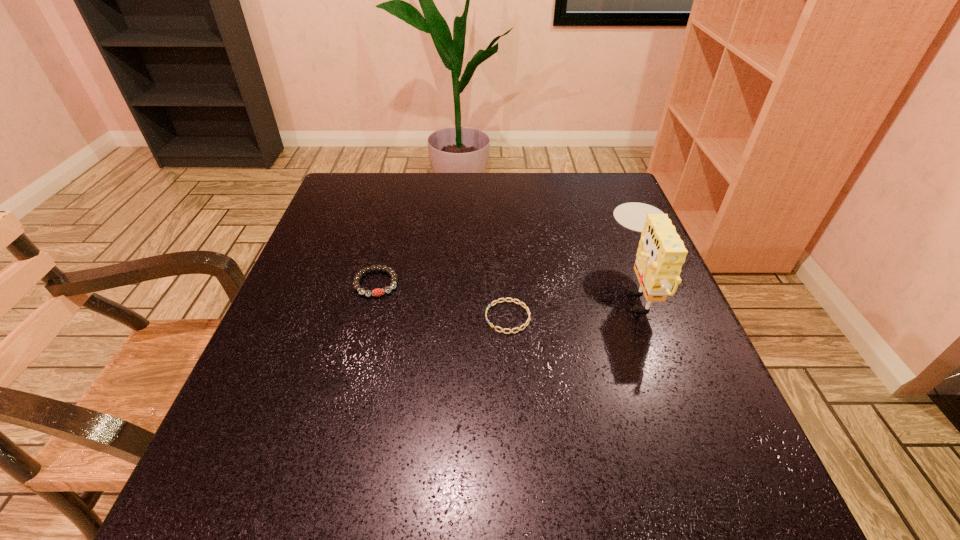
Identify the location of free spot at the near right corner of the desktop. This screenshot has width=960, height=540. (765, 528).

What are the coordinates of `vacant space in between the sponge and the taller bracelet` in the screenshot? It's located at (507, 286).

Identify the location of vacant region between the shortest object and the sponge. The image size is (960, 540). (573, 303).

At what (x,y) coordinates should I click in order to perform the action: click on empty location between the tallest object and the taller bracelet. Please return your answer as a coordinate pair (x, y). The image size is (960, 540). Looking at the image, I should click on (507, 286).

The image size is (960, 540). Find the location of `vacant region between the left bracelet and the shorter bracelet`. vacant region between the left bracelet and the shorter bracelet is located at coordinates (442, 300).

Where is `vacant point located between the rightmost object and the shortest object`? vacant point located between the rightmost object and the shortest object is located at coordinates (573, 303).

Locate an element on the screen. Image resolution: width=960 pixels, height=540 pixels. vacant area between the rightmost object and the taller bracelet is located at coordinates (507, 286).

Find the location of a particular element. Image resolution: width=960 pixels, height=540 pixels. free space between the shortest object and the second shortest object is located at coordinates (442, 300).

At what (x,y) coordinates should I click in order to perform the action: click on free space between the left bracelet and the second object from right to left. Please return your answer as a coordinate pair (x, y). This screenshot has width=960, height=540. Looking at the image, I should click on (442, 300).

Locate an element on the screen. This screenshot has width=960, height=540. vacant area that lies between the taller bracelet and the sponge is located at coordinates (507, 286).